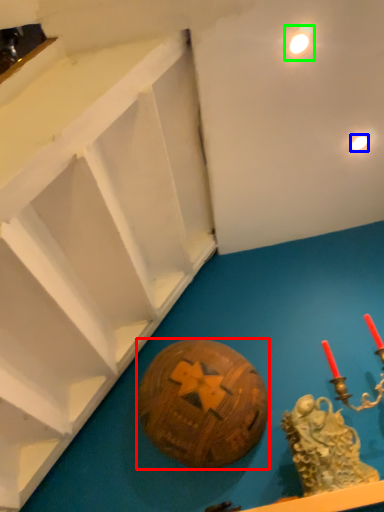
Question: Which object is the closest to the ball (highlighted by a red box)? Choose among these: light (highlighted by a blue box) or light (highlighted by a green box).

Choices:
 (A) light
 (B) light

Answer: (A)